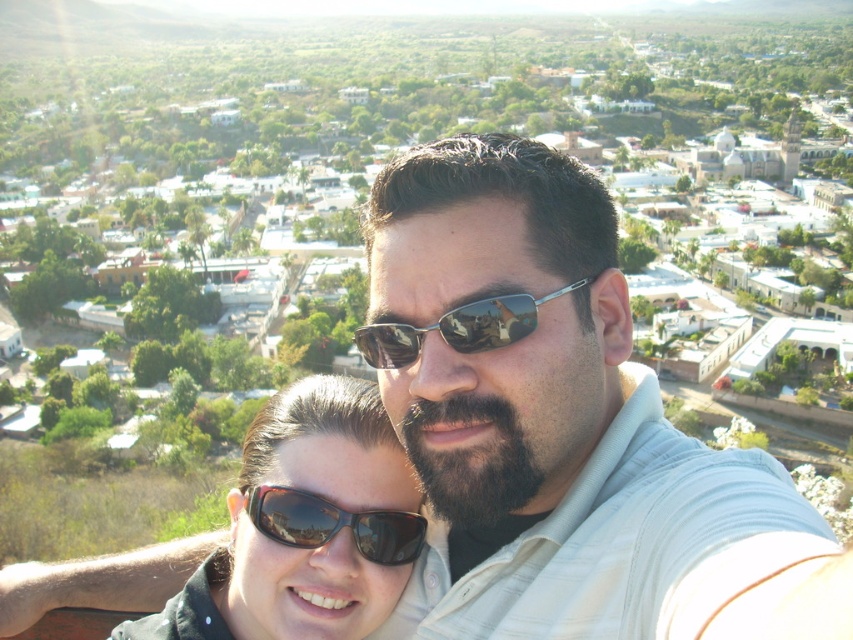
Question: Can you confirm if black reflective sunglasses at center is positioned below metallic reflective sunglasses at center?

Choices:
 (A) no
 (B) yes

Answer: (B)

Question: Is black reflective sunglasses at center bigger than metallic reflective sunglasses at center?

Choices:
 (A) no
 (B) yes

Answer: (A)

Question: Which point appears closest to the camera in this image?

Choices:
 (A) (392, 342)
 (B) (508, 461)

Answer: (B)

Question: In this image, where is black reflective sunglasses at center located relative to metallic reflective sunglasses at center?

Choices:
 (A) right
 (B) left

Answer: (B)

Question: Which object appears farthest from the camera in this image?

Choices:
 (A) matte white shirt at center
 (B) black matte sunglasses at center
 (C) metallic reflective sunglasses at center

Answer: (B)

Question: Among these points, which one is nearest to the camera?

Choices:
 (A) (561, 467)
 (B) (221, 544)
 (C) (448, 323)

Answer: (C)